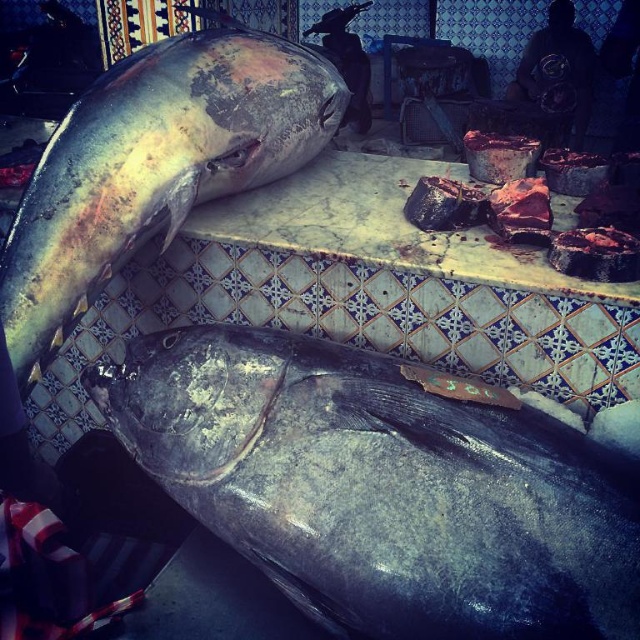
Does point (314, 422) come in front of point (88, 160)?

Yes, it is in front of point (88, 160).

Between shiny dark gray fish at center and shiny silver fish at center, which one appears on the right side from the viewer's perspective?

shiny dark gray fish at center

Describe the element at coordinates (381, 488) in the screenshot. I see `shiny dark gray fish at center` at that location.

Identify the location of shiny dark gray fish at center. (381, 488).